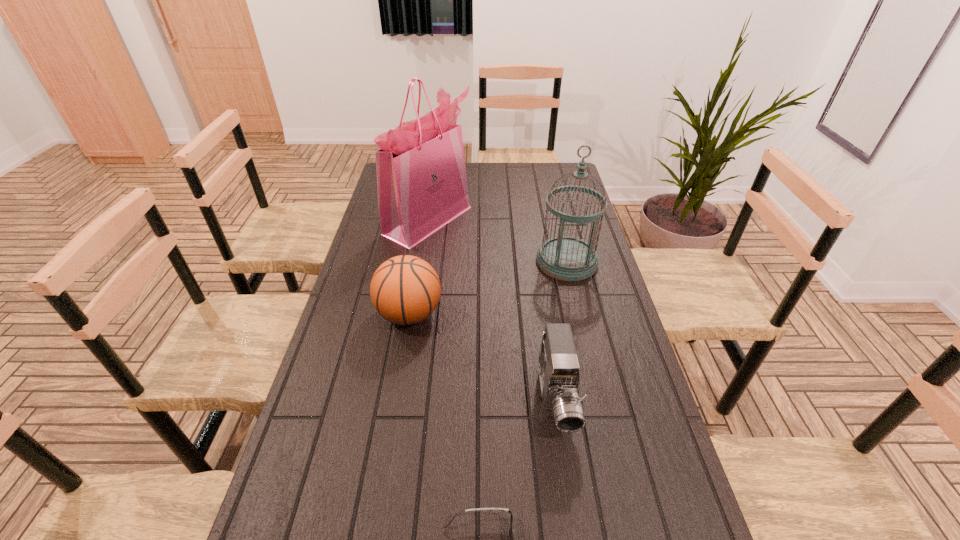
Locate an element on the screen. This screenshot has height=540, width=960. shopping bag is located at coordinates (421, 174).

The width and height of the screenshot is (960, 540). What are the coordinates of `birdcage` in the screenshot? It's located at (567, 258).

Locate an element on the screen. basketball is located at coordinates (405, 290).

Locate an element on the screen. This screenshot has width=960, height=540. the second nearest object is located at coordinates (559, 372).

This screenshot has width=960, height=540. Identify the location of vacant region located 0.120m on the back of the shopping bag. (434, 182).

You are a GUI agent. You are given a task and a screenshot of the screen. Output one action in this format:
    pyautogui.click(x=<x>, y=<y>)
    Task: Click on the vacant space located on the front-facing side of the birdcage
    The height and width of the screenshot is (540, 960).
    Given the screenshot: What is the action you would take?
    pyautogui.click(x=590, y=363)

At what (x,y) coordinates should I click in order to perform the action: click on vacant area situated on the front of the basketball. Please return your answer as a coordinate pair (x, y). The image size is (960, 540). Looking at the image, I should click on (386, 450).

Locate an element on the screen. vacant space located at the front of the second nearest object, highlighting the lens is located at coordinates (575, 525).

The width and height of the screenshot is (960, 540). I want to click on shopping bag that is at the left edge, so click(421, 174).

The width and height of the screenshot is (960, 540). In order to click on basketball at the left edge in this screenshot , I will do `click(405, 290)`.